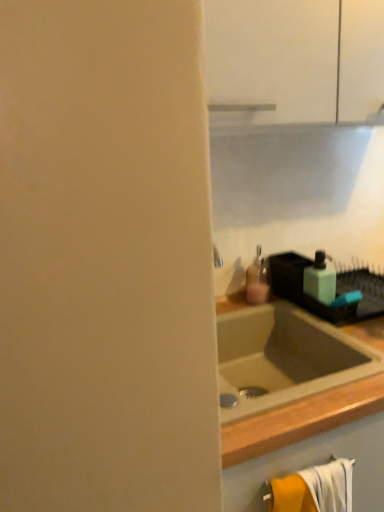
Question: Relative to matte pink plastic soap dispenser at center, which is the 2th soap dispenser in right-to-left order, is orange cotton bath towel at lower right in front or behind?

Choices:
 (A) front
 (B) behind

Answer: (A)

Question: Is orange cotton bath towel at lower right situated inside matte pink plastic soap dispenser at center, which is the 2th soap dispenser in right-to-left order, or outside?

Choices:
 (A) outside
 (B) inside

Answer: (A)

Question: Which of these objects is positioned farthest from the orange cotton bath towel at lower right?

Choices:
 (A) green matte soap dispenser at right, which is the 1th soap dispenser from right to left
 (B) matte pink plastic soap dispenser at center, placed as the 1th soap dispenser when sorted from left to right

Answer: (B)

Question: Estimate the real-world distances between objects in this image. Which object is closer to the green matte soap dispenser at right, which is the 1th soap dispenser from right to left?

Choices:
 (A) orange cotton bath towel at lower right
 (B) matte pink plastic soap dispenser at center, placed as the 1th soap dispenser when sorted from left to right

Answer: (B)